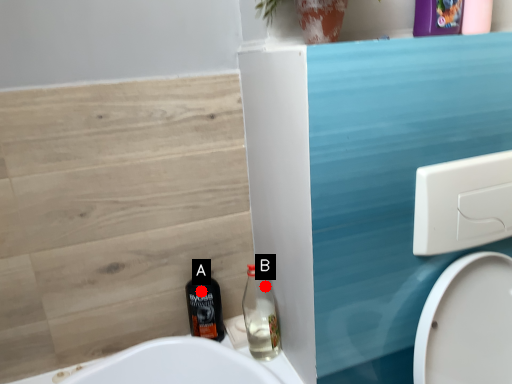
Question: Two points are circled on the image, labeled by A and B beside each circle. Which point is further to the camera?

Choices:
 (A) A is further
 (B) B is further

Answer: (B)